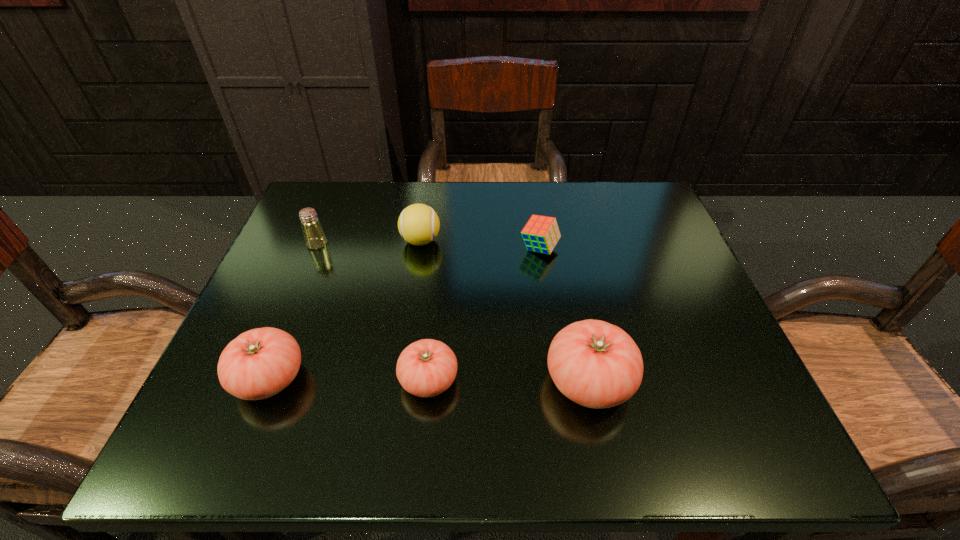
The height and width of the screenshot is (540, 960). Identify the location of vacant space that satisfies the following two spatial constraints: 1. on the back side of the second shortest tomato; 2. on the right side of the tennis ball. (324, 241).